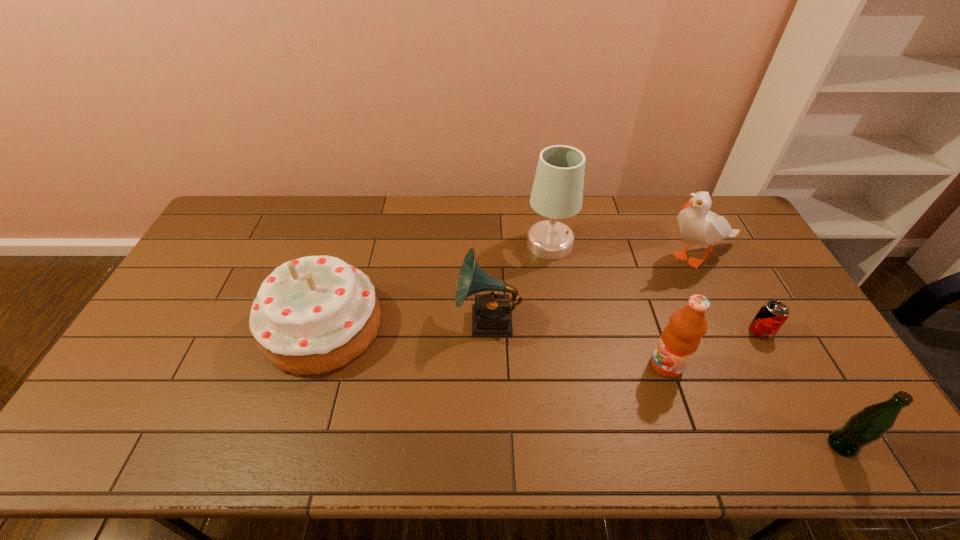
Identify which object is located as the fourth nearest to the tallest object. Please provide its 2D coordinates. Your answer should be formatted as a tuple, i.e. [(x, y)], where the tuple contains the x and y coordinates of a point satisfying the conditions above.

[(312, 315)]

Identify which object is located as the fifth nearest to the fifth object from right to left. Please provide its 2D coordinates. Your answer should be formatted as a tuple, i.e. [(x, y)], where the tuple contains the x and y coordinates of a point satisfying the conditions above.

[(772, 315)]

Image resolution: width=960 pixels, height=540 pixels. Identify the location of vacant space that satisfies the following two spatial constraints: 1. on the base of the soda can; 2. on the left side of the fifth object from right to left. (564, 332).

Locate an element on the screen. blank area in the image that satisfies the following two spatial constraints: 1. on the base of the beer bottle; 2. on the right side of the third object from left to right is located at coordinates (583, 445).

Identify the location of free location that satisfies the following two spatial constraints: 1. at the beak of the beer bottle; 2. on the left side of the gull. (789, 445).

Where is `free location that satisfies the following two spatial constraints: 1. at the beak of the beer bottle; 2. on the left side of the gull`? The height and width of the screenshot is (540, 960). free location that satisfies the following two spatial constraints: 1. at the beak of the beer bottle; 2. on the left side of the gull is located at coordinates (789, 445).

The height and width of the screenshot is (540, 960). I want to click on free region that satisfies the following two spatial constraints: 1. on the base of the beer bottle; 2. on the left side of the lampshade, so click(583, 445).

Locate an element on the screen. vacant region that satisfies the following two spatial constraints: 1. on the base of the tallest object; 2. on the right side of the soda can is located at coordinates (564, 332).